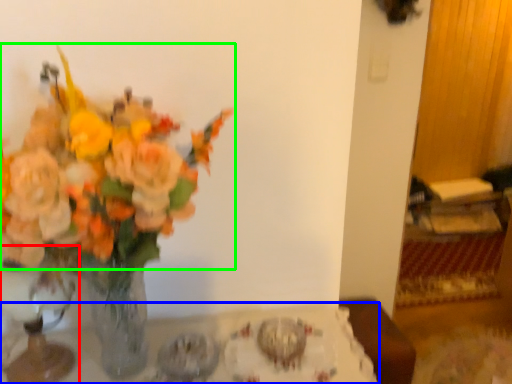
Question: Based on their relative distances, which object is farther from vase (highlighted by a red box)? Choose from table (highlighted by a blue box) and flower (highlighted by a green box).

Choices:
 (A) table
 (B) flower

Answer: (B)